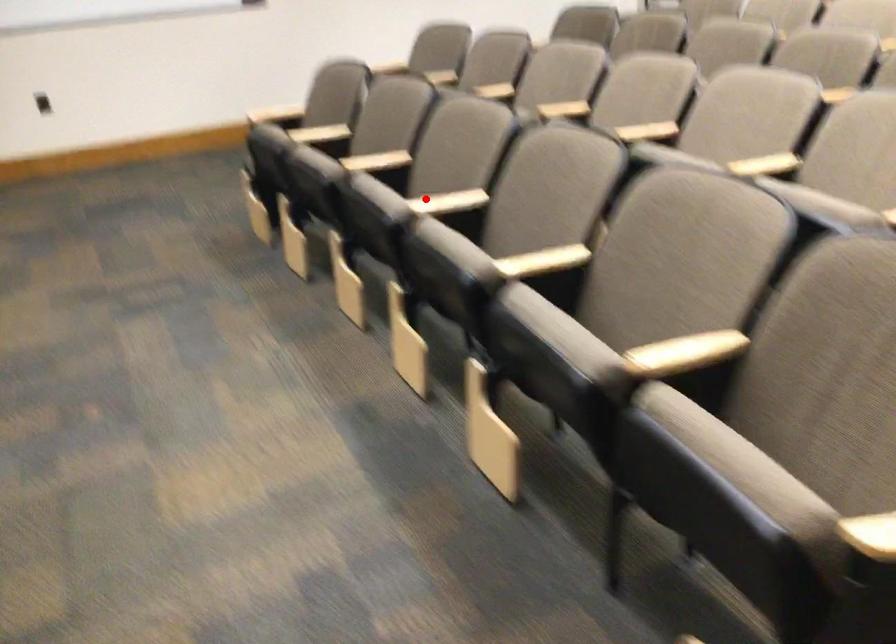
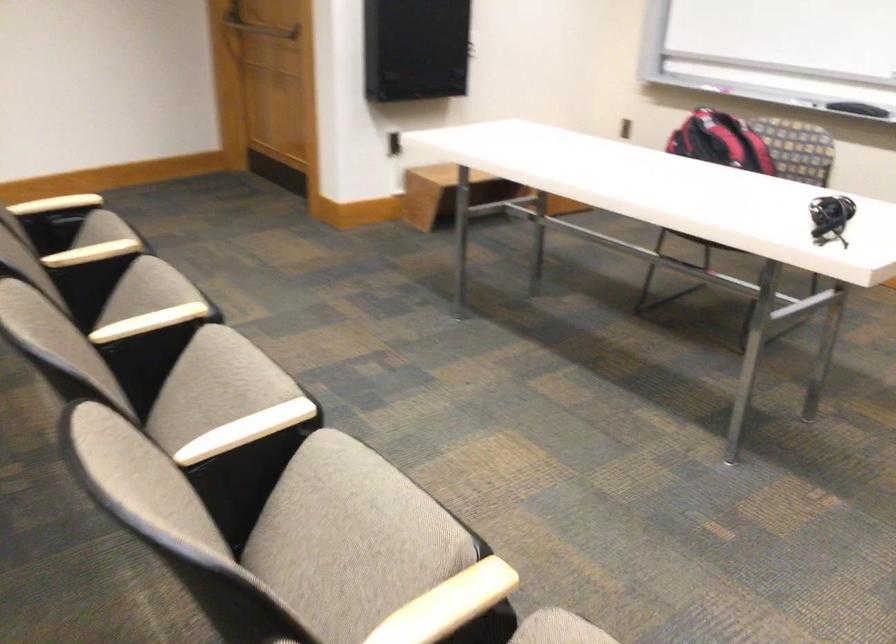
Question: I am providing you with two images of the same scene from different viewpoints. In image1, a red point is highlighted. Considering the same 3D point in image2, which of the following is correct?

Choices:
 (A) It is closer
 (B) It is farther

Answer: (A)